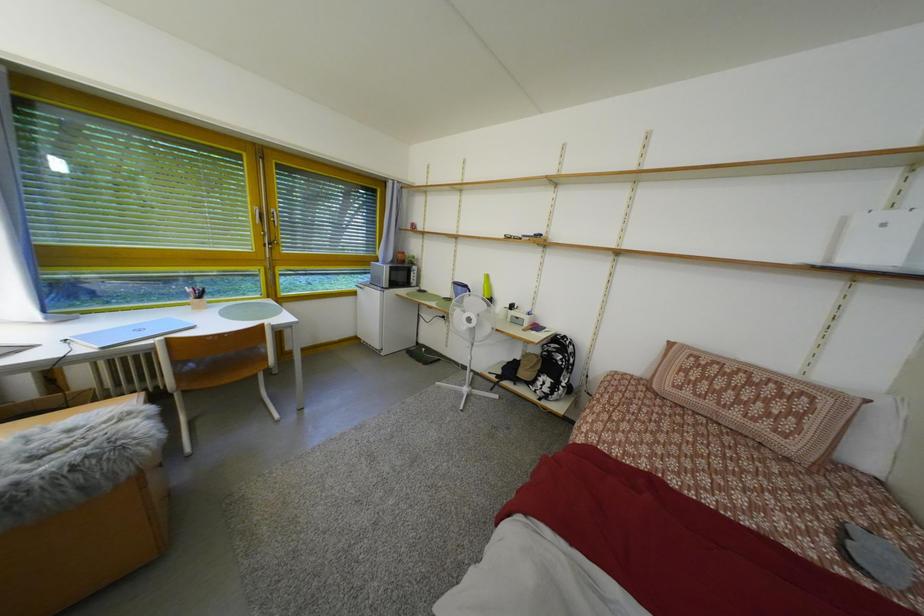
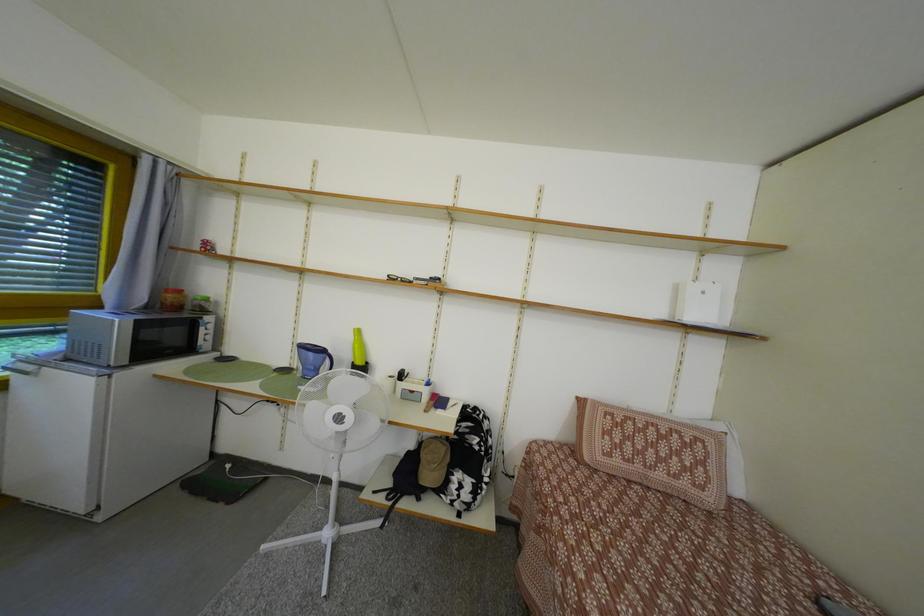
Question: The camera is either moving clockwise (left) or counter-clockwise (right) around the object. The first image is from the beginning of the video and the second image is from the end. Is the camera moving left or right when shooting the video?

Choices:
 (A) Left
 (B) Right

Answer: (A)